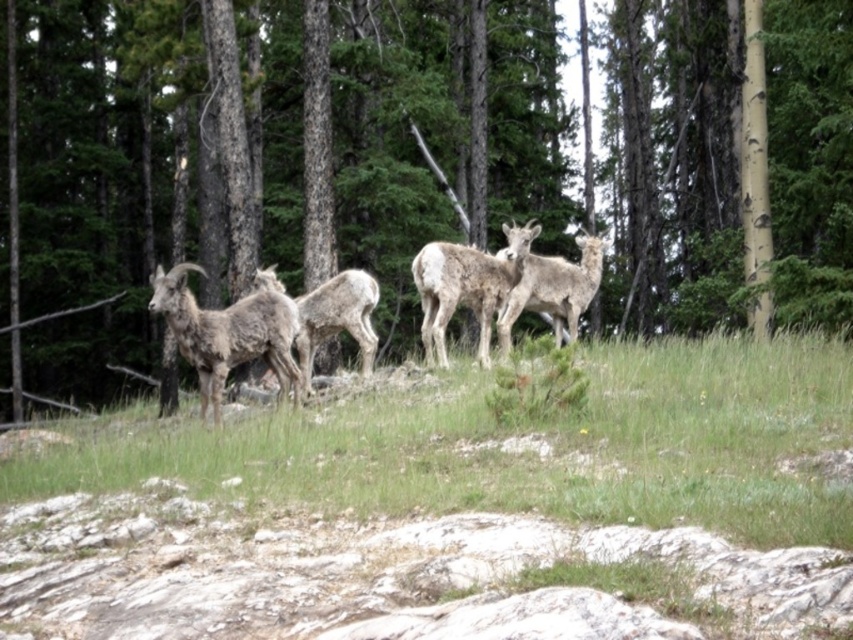
You are a hiker trying to navigate through the grassy hillside where the bighorn sheep are standing. You need to move from the point at coordinates point (741, 452) to point (590, 253). Which direction should you move to reach your destination?

To move from point (741, 452) to point (590, 253), you should move backward since point (741, 452) is in front of point (590, 253).

You are a hiker trying to locate the brown textured tree at center from your current position. Based on the scene description, can you determine the direction you should face to see the tree?

The brown textured tree at center is located at point [410,163], which would be center right in the image. So you should face towards the center right direction to see the brown textured tree at center.

Consider the image. You are a photographer standing at the base of the hillside where the bighorn sheep are grazing. You want to take a photo that includes both the point at coordinates point [207,330] and point [306,292]. Which point should you focus on first to ensure both are in clear view?

You should focus on point [207,330] first because it is closer to you than point [306,292], ensuring both points remain in clear view when adjusting the camera.